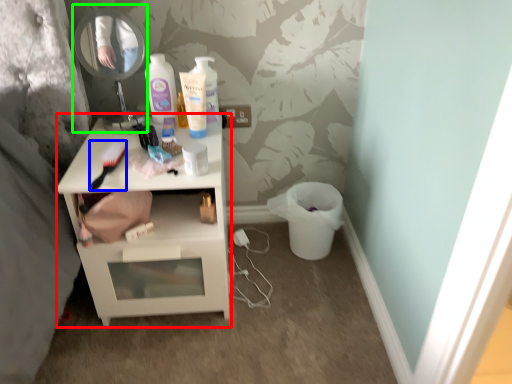
Question: Which object is positioned farthest from nightstand (highlighted by a red box)? Select from brush (highlighted by a blue box) and mirror (highlighted by a green box).

Choices:
 (A) brush
 (B) mirror

Answer: (B)